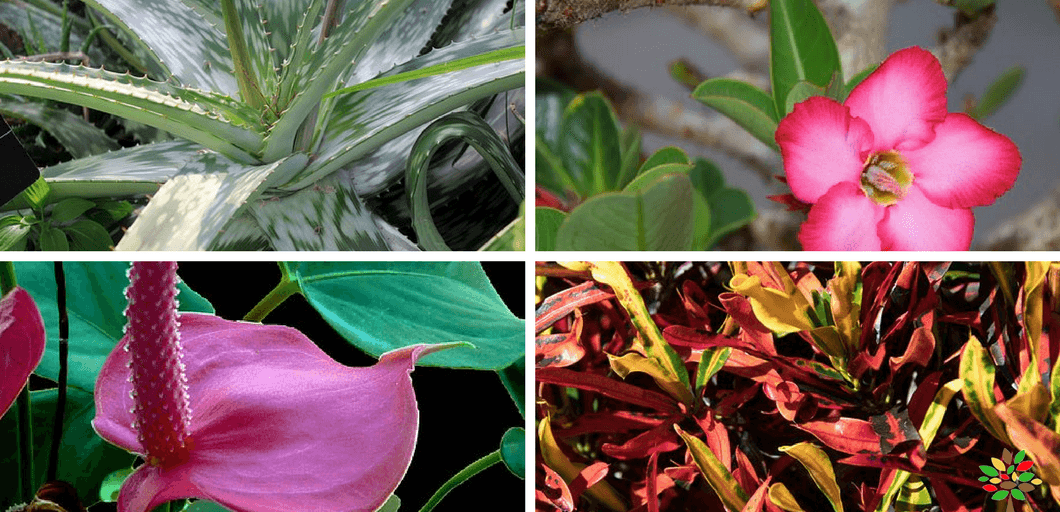
Locate an element on the screen. This screenshot has width=1060, height=512. picture is located at coordinates (633, 114), (318, 94), (319, 291), (706, 343).